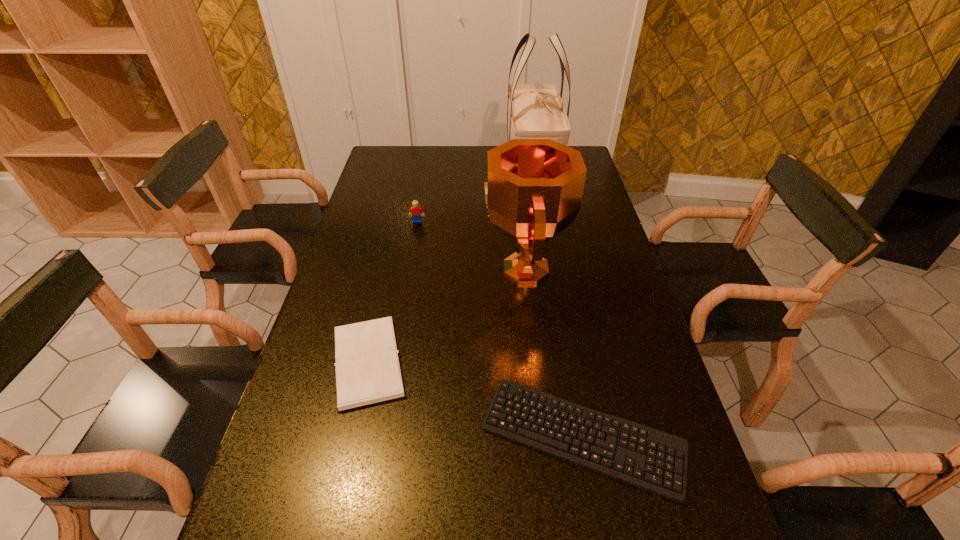
Where is `free space located on the side of the second tallest object with the star emblem`? Image resolution: width=960 pixels, height=540 pixels. free space located on the side of the second tallest object with the star emblem is located at coordinates (399, 269).

Identify the location of vacant region located on the side of the second tallest object with the star emblem. (366, 269).

Locate an element on the screen. vacant area situated on the face of the second farthest object is located at coordinates (402, 305).

The width and height of the screenshot is (960, 540). In order to click on free location located 0.230m on the front of the second shortest object in this screenshot , I will do `click(331, 528)`.

The width and height of the screenshot is (960, 540). I want to click on vacant region located 0.150m on the left of the computer keyboard, so click(411, 436).

I want to click on object present at the far edge, so 534,111.

At what (x,y) coordinates should I click in order to perform the action: click on object located at the left edge. Please return your answer as a coordinate pair (x, y). Looking at the image, I should click on (368, 370).

You are a GUI agent. You are given a task and a screenshot of the screen. Output one action in this format:
    pyautogui.click(x=<x>, y=<y>)
    Task: Click on the shopping bag at the right edge
    This screenshot has width=960, height=540.
    Given the screenshot: What is the action you would take?
    pyautogui.click(x=534, y=111)

In order to click on computer keyboard that is at the right edge in this screenshot , I will do `click(652, 460)`.

The image size is (960, 540). I want to click on object that is at the far right corner, so click(534, 111).